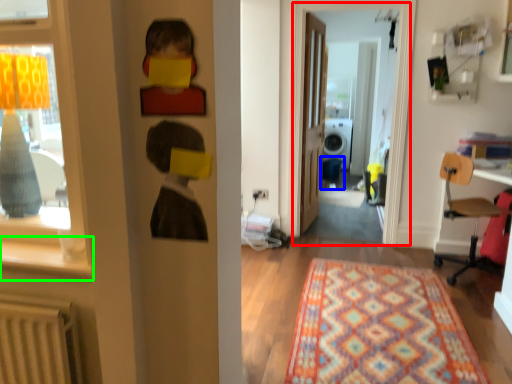
Question: Considering the real-world distances, which object is farthest from window screen (highlighted by a red box)? armchair (highlighted by a blue box) or window sill (highlighted by a green box)?

Choices:
 (A) armchair
 (B) window sill

Answer: (B)